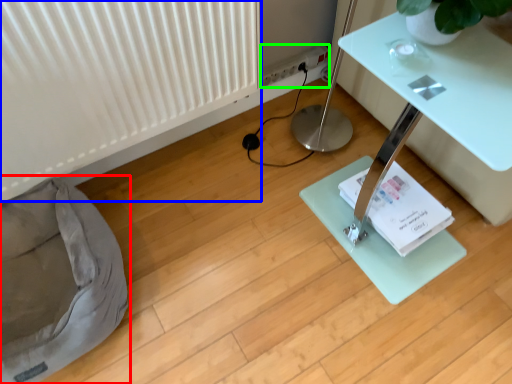
Question: Based on their relative distances, which object is farther from bean bag chair (highlighted by a red box)? Choose from radiator (highlighted by a blue box) and electric outlet (highlighted by a green box).

Choices:
 (A) radiator
 (B) electric outlet

Answer: (B)